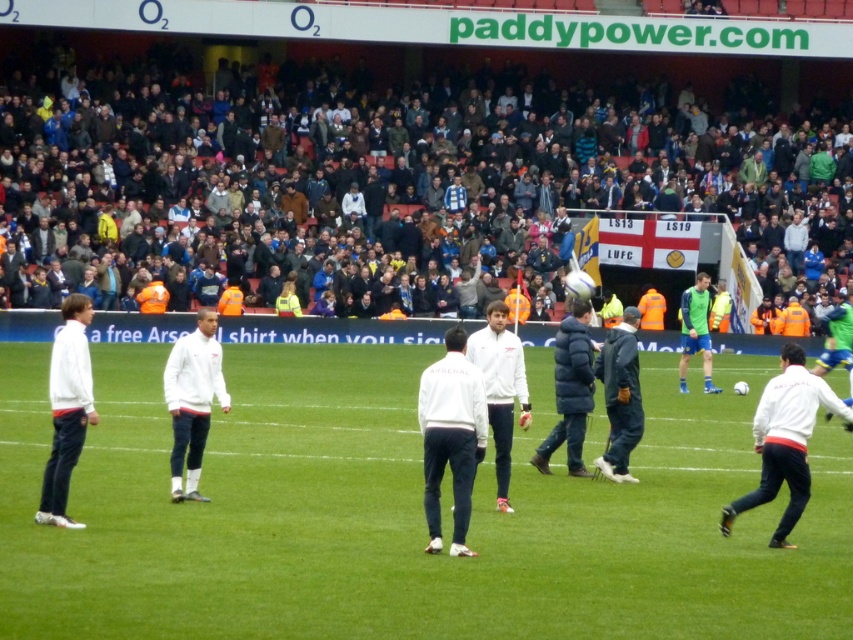
Question: Among these objects, which one is nearest to the camera?

Choices:
 (A) white matte jacket at lower right
 (B) green grass field at center
 (C) dark gray crowd at upper center

Answer: (B)

Question: Which point is closer to the camera?

Choices:
 (A) (830, 408)
 (B) (608, 576)

Answer: (B)

Question: Does green grass field at center come behind dark gray crowd at upper center?

Choices:
 (A) no
 (B) yes

Answer: (A)

Question: Is dark gray crowd at upper center thinner than white matte jacket at lower right?

Choices:
 (A) no
 (B) yes

Answer: (A)

Question: Estimate the real-world distances between objects in this image. Which object is farther from the white matte jacket at lower right?

Choices:
 (A) green grass field at center
 (B) dark gray crowd at upper center

Answer: (B)

Question: Is green grass field at center further to camera compared to dark gray crowd at upper center?

Choices:
 (A) no
 (B) yes

Answer: (A)